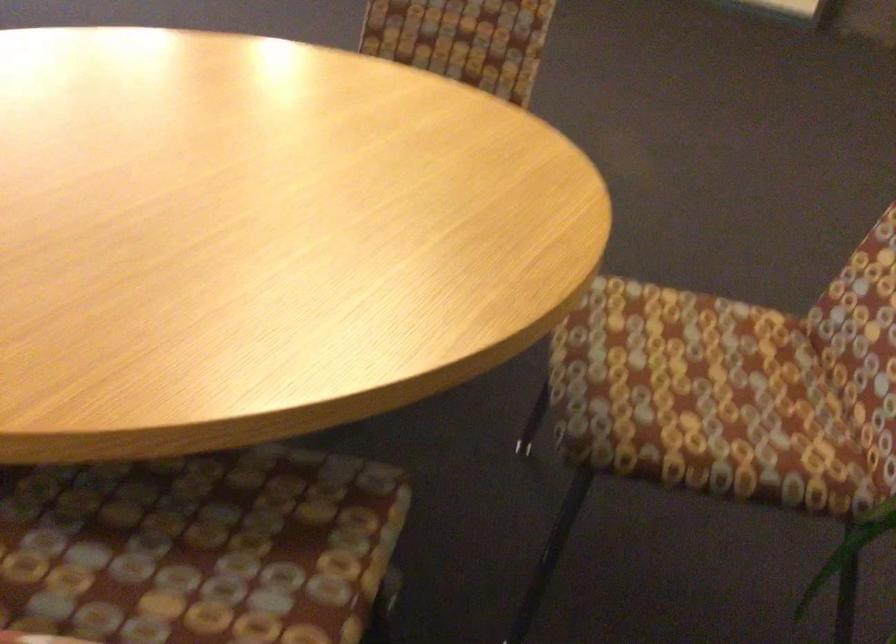
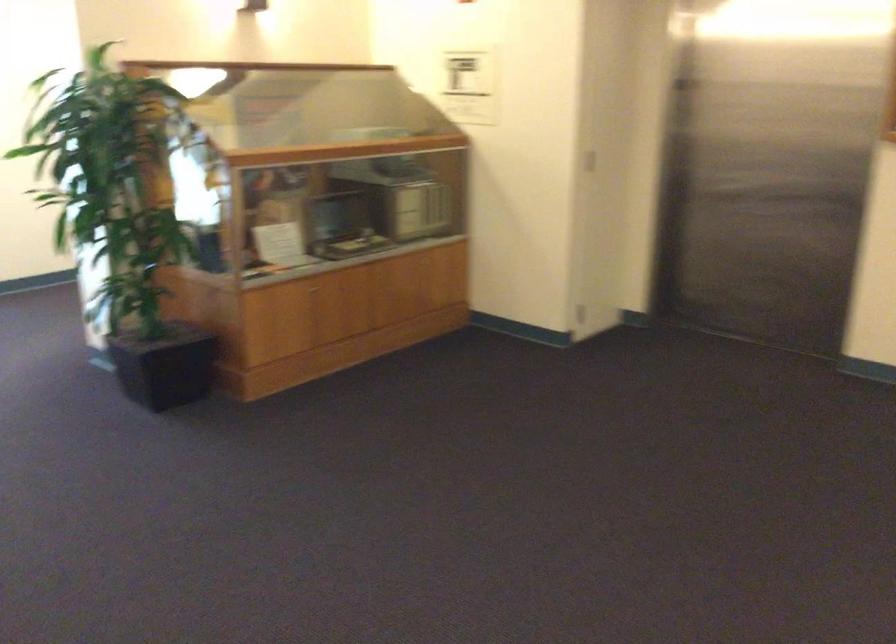
How did the camera likely rotate?

The camera rotated toward right-down.